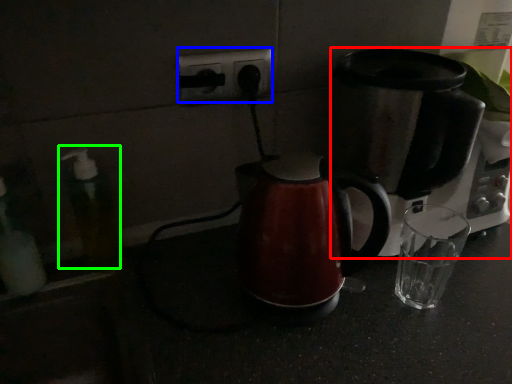
Question: Which object is positioned closest to coffee maker (highlighted by a red box)? Select from electric outlet (highlighted by a blue box) and soap dispenser (highlighted by a green box).

Choices:
 (A) electric outlet
 (B) soap dispenser

Answer: (A)